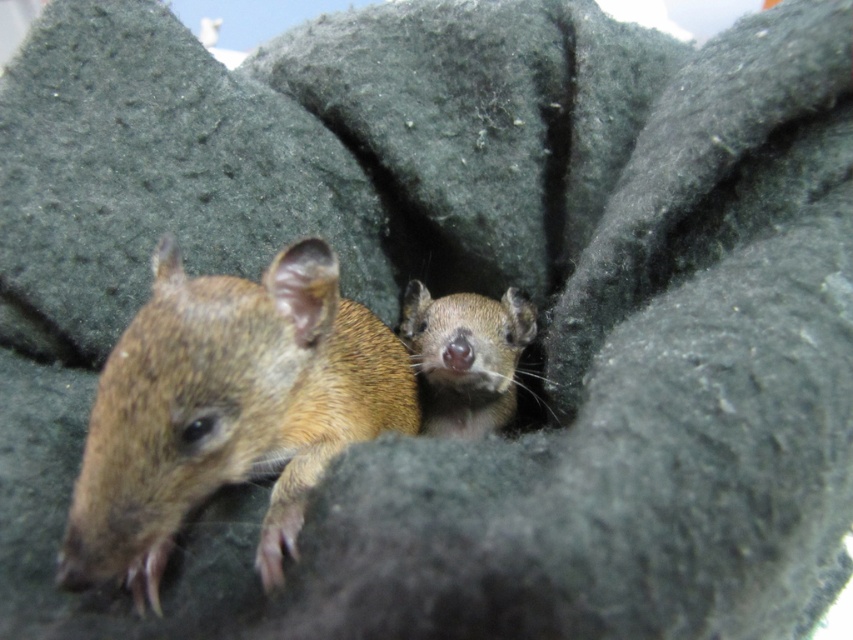
Question: In this image, where is brown fuzzy mouse at left located relative to fuzzy brown mouse at center?

Choices:
 (A) below
 (B) above

Answer: (B)

Question: Which point appears farthest from the camera in this image?

Choices:
 (A) (490, 333)
 (B) (260, 406)

Answer: (A)

Question: Is brown fuzzy mouse at left smaller than fuzzy brown mouse at center?

Choices:
 (A) yes
 (B) no

Answer: (B)

Question: Observing the image, what is the correct spatial positioning of brown fuzzy mouse at left in reference to fuzzy brown mouse at center?

Choices:
 (A) right
 (B) left

Answer: (B)